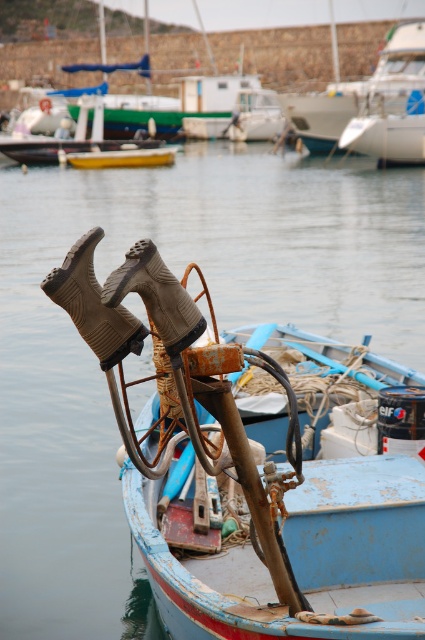
Question: Considering the relative positions of rusty metal boat at center and white glossy sailboat at upper right in the image provided, where is rusty metal boat at center located with respect to white glossy sailboat at upper right?

Choices:
 (A) above
 (B) below

Answer: (B)

Question: Which point is farther from the camera taking this photo?

Choices:
 (A) (231, 330)
 (B) (411, 58)

Answer: (B)

Question: From the image, what is the correct spatial relationship of rusty metal boat at center in relation to white glossy sailboat at upper right?

Choices:
 (A) above
 (B) below

Answer: (B)

Question: Can you confirm if rusty metal boat at center is wider than white glossy sailboat at upper right?

Choices:
 (A) yes
 (B) no

Answer: (B)